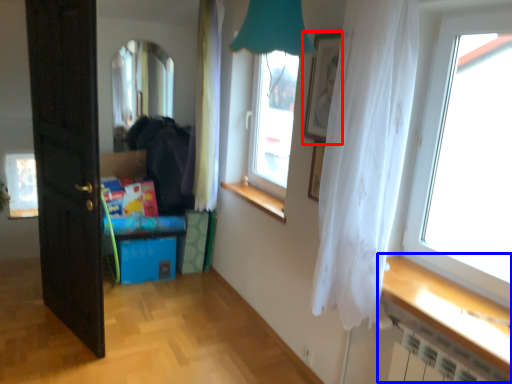
Question: Which of the following is the farthest to the observer, picture frame (highlighted by a red box) or table (highlighted by a blue box)?

Choices:
 (A) picture frame
 (B) table

Answer: (A)